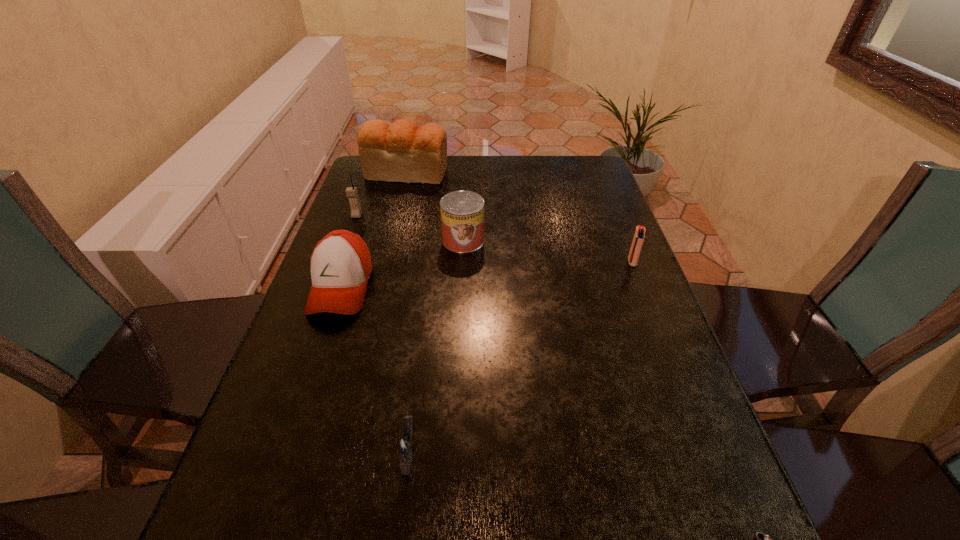
The width and height of the screenshot is (960, 540). Identify the location of free spot located on the front of the second farthest object, where the keypad is located. (337, 269).

Where is `vacant region located 0.250m on the front-facing side of the baseball cap`? The width and height of the screenshot is (960, 540). vacant region located 0.250m on the front-facing side of the baseball cap is located at coordinates (295, 425).

This screenshot has width=960, height=540. Find the location of `vacant region located on the back of the can`. vacant region located on the back of the can is located at coordinates (466, 185).

Identify the location of vacant space situated on the front of the tallest igniter. (659, 328).

The width and height of the screenshot is (960, 540). Identify the location of vacant area located on the back of the sixth farthest object. (426, 314).

Image resolution: width=960 pixels, height=540 pixels. I want to click on object that is positioned at the far edge, so click(x=400, y=152).

This screenshot has width=960, height=540. What are the coordinates of `bread present at the left edge` in the screenshot? It's located at (400, 152).

What are the coordinates of `cellular telephone located at the left edge` in the screenshot? It's located at (351, 192).

Find the location of a particular element. This screenshot has height=540, width=960. baseball cap that is at the left edge is located at coordinates (340, 265).

This screenshot has height=540, width=960. In order to click on object located at the right edge in this screenshot , I will do `click(638, 240)`.